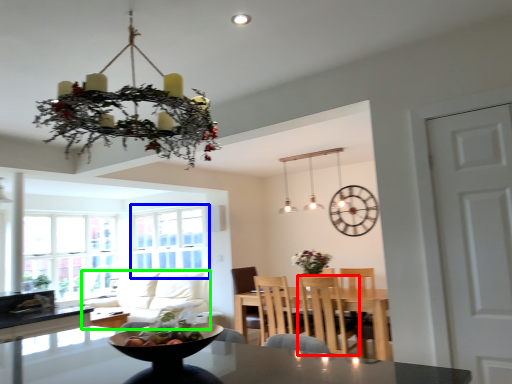
Question: Which is farther away from chair (highlighted by a red box)? window screen (highlighted by a blue box) or couch (highlighted by a green box)?

Choices:
 (A) window screen
 (B) couch

Answer: (A)